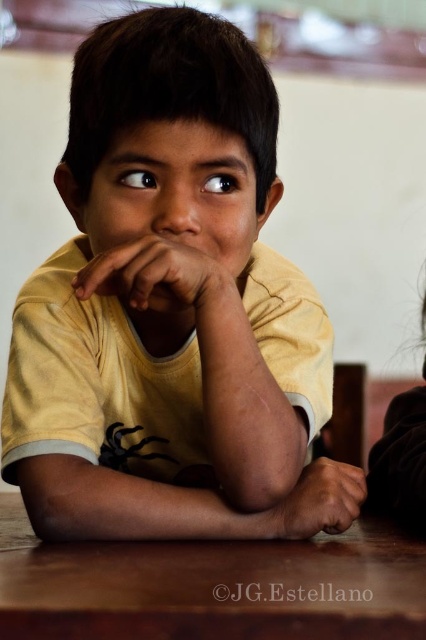
You are a photographer adjusting the lighting in the studio. You notice the yellow matte shirt at center and the brown polished wood table at lower center. Which object should you focus the light on to ensure the larger object is properly illuminated?

The yellow matte shirt at center is bigger than the brown polished wood table at lower center, so you should focus the light on the yellow matte shirt at center to ensure the larger object is properly illuminated.